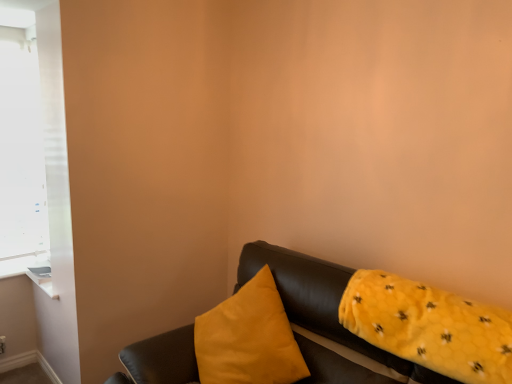
Question: Considering the relative sizes of white matte window at upper left and matte yellow pillow at center, the first pillow positioned from the left, in the image provided, is white matte window at upper left wider than matte yellow pillow at center, the first pillow positioned from the left,?

Choices:
 (A) yes
 (B) no

Answer: (B)

Question: From a real-world perspective, is white matte window at upper left located higher than matte yellow pillow at center, the second pillow positioned from the right?

Choices:
 (A) no
 (B) yes

Answer: (B)

Question: Is white matte window at upper left not within matte yellow pillow at center, the first pillow positioned from the left?

Choices:
 (A) yes
 (B) no

Answer: (A)

Question: From a real-world perspective, is white matte window at upper left physically below matte yellow pillow at center, the first pillow positioned from the left?

Choices:
 (A) yes
 (B) no

Answer: (B)

Question: From the image's perspective, is white matte window at upper left beneath matte yellow pillow at center, the second pillow positioned from the right?

Choices:
 (A) no
 (B) yes

Answer: (A)

Question: Considering the relative sizes of white matte window at upper left and matte yellow pillow at center, the second pillow positioned from the right, in the image provided, is white matte window at upper left taller than matte yellow pillow at center, the second pillow positioned from the right,?

Choices:
 (A) no
 (B) yes

Answer: (B)

Question: Can you confirm if leather couch at lower right is taller than white matte window at upper left?

Choices:
 (A) no
 (B) yes

Answer: (A)

Question: From a real-world perspective, does leather couch at lower right stand above white matte window at upper left?

Choices:
 (A) yes
 (B) no

Answer: (B)

Question: Is leather couch at lower right not inside white matte window at upper left?

Choices:
 (A) yes
 (B) no

Answer: (A)

Question: Does leather couch at lower right lie behind white matte window at upper left?

Choices:
 (A) yes
 (B) no

Answer: (B)

Question: Does leather couch at lower right come in front of white matte window at upper left?

Choices:
 (A) no
 (B) yes

Answer: (B)

Question: Is leather couch at lower right not near white matte window at upper left?

Choices:
 (A) no
 (B) yes

Answer: (B)

Question: Is yellow fuzzy pillow at right, arranged as the second pillow when viewed from the left, taller than leather couch at lower right?

Choices:
 (A) yes
 (B) no

Answer: (B)